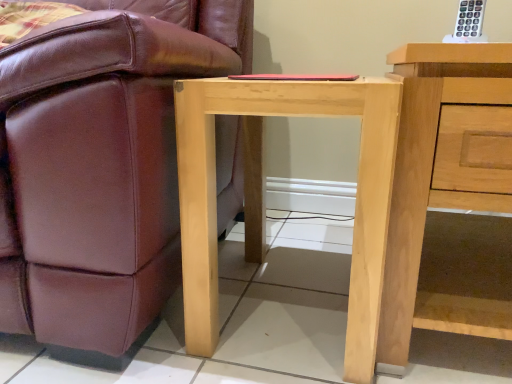
Identify the location of free space behind natural wood table at center. (300, 241).